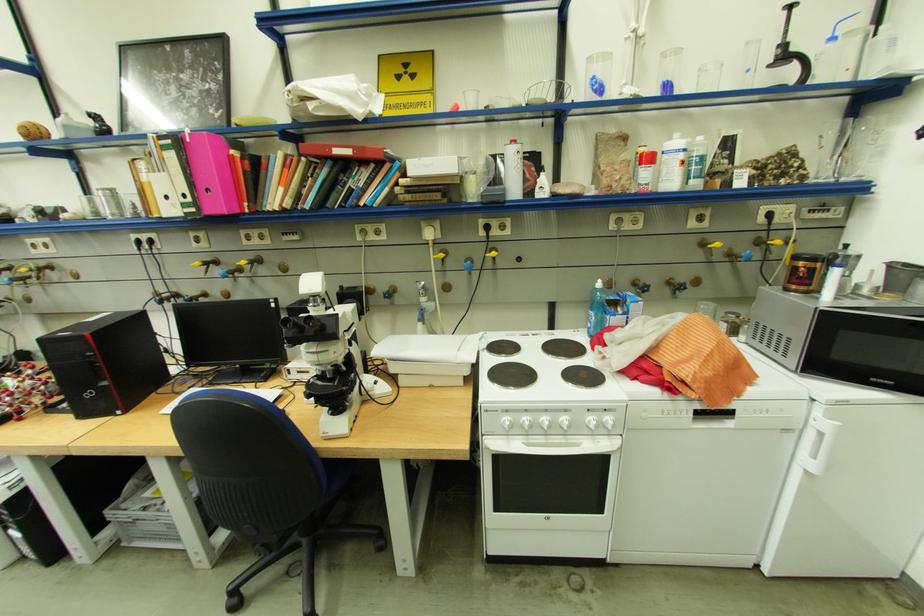
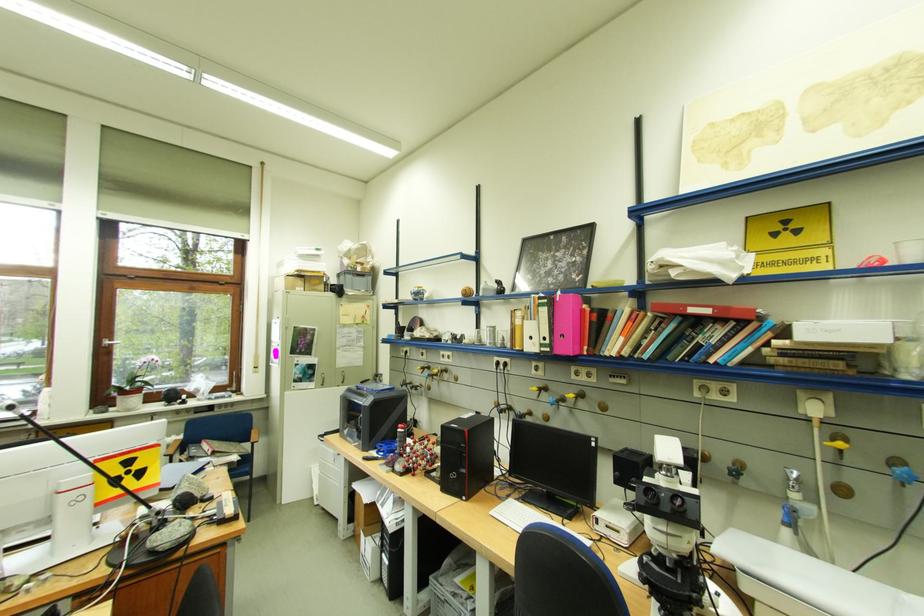
Where in the second image is the point corresponding to point (203, 211) from the first image?

(558, 351)